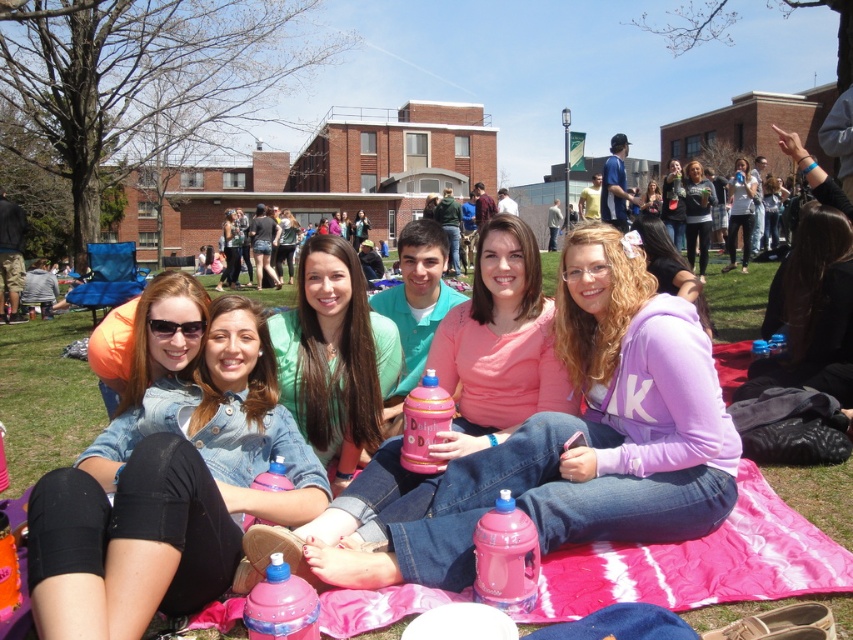
Question: Which object is positioned closest to the pink matte water bottle at center?

Choices:
 (A) green matte shirt at center
 (B) denim jacket at center
 (C) pink plastic water bottle at lower center

Answer: (C)

Question: Can you confirm if pink plastic water bottle at lower center is positioned below pink plastic water bottle at center?

Choices:
 (A) yes
 (B) no

Answer: (B)

Question: Does pink matte water bottle at center lie in front of pink plastic bottle at center?

Choices:
 (A) no
 (B) yes

Answer: (B)

Question: Which point is closer to the camera?

Choices:
 (A) pink plastic bottle at center
 (B) pink plastic water bottle at center
 (C) pink matte water bottle at center
 (D) matte black jacket at upper right

Answer: (B)

Question: Is pink plastic water bottle at center thinner than matte black hoodie at upper right?

Choices:
 (A) yes
 (B) no

Answer: (A)

Question: Which point is farther to the camera?

Choices:
 (A) (151, 483)
 (B) (666, 230)
 (C) (692, 230)

Answer: (C)